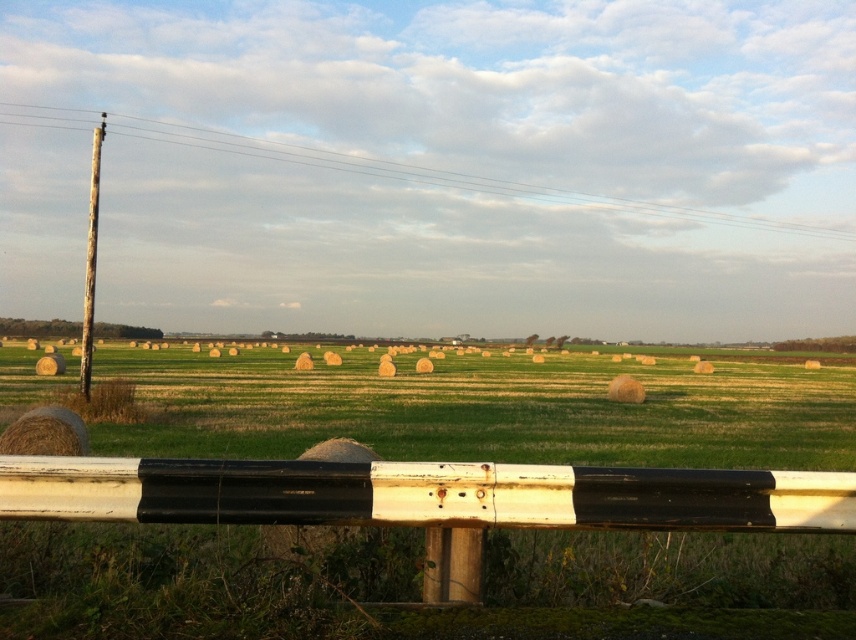
Question: Is the position of yellow straw bales at center less distant than that of weathered wood pole at left?

Choices:
 (A) no
 (B) yes

Answer: (B)

Question: Which object appears closest to the camera in this image?

Choices:
 (A) weathered wood pole at left
 (B) yellow straw bales at center

Answer: (B)

Question: Among these points, which one is farthest from the camera?

Choices:
 (A) (110, 378)
 (B) (86, 355)

Answer: (A)

Question: Does yellow straw bales at center appear over weathered wood pole at left?

Choices:
 (A) no
 (B) yes

Answer: (A)

Question: Which of the following is the closest to the observer?

Choices:
 (A) (100, 118)
 (B) (557, 433)

Answer: (B)

Question: Does yellow straw bales at center have a greater width compared to weathered wood pole at left?

Choices:
 (A) yes
 (B) no

Answer: (A)